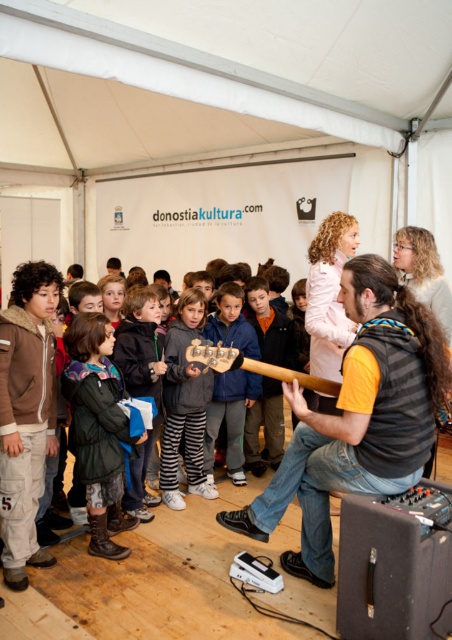
Is dark green jacket at center taller than wooden guitar at center?

Correct, dark green jacket at center is much taller as wooden guitar at center.

Between dark green jacket at center and wooden guitar at center, which one is positioned lower?

dark green jacket at center

Is point (108, 440) closer to camera compared to point (254, 369)?

No, (108, 440) is further to viewer.

Where is `dark green jacket at center`? The image size is (452, 640). dark green jacket at center is located at coordinates (98, 428).

From the picture: Who is more distant from viewer, (x=230, y=440) or (x=207, y=365)?

Point (x=230, y=440)

Between blue fabric jacket at center and wooden guitar at center, which one has less height?

With less height is wooden guitar at center.

Measure the distance between point [240,419] and camera.

Point [240,419] and camera are 3.99 meters apart from each other.

Where is `blue fabric jacket at center`? This screenshot has width=452, height=640. blue fabric jacket at center is located at coordinates (230, 419).

Which is more to the right, gray fleece jacket at center or blue fabric jacket at center?

blue fabric jacket at center

Between point (202, 481) and point (203, 440), which one is positioned behind?

Positioned behind is point (203, 440).

Identify the location of gray fleece jacket at center. This screenshot has height=640, width=452. (184, 403).

This screenshot has height=640, width=452. Find the location of `gray fleece jacket at center`. gray fleece jacket at center is located at coordinates (184, 403).